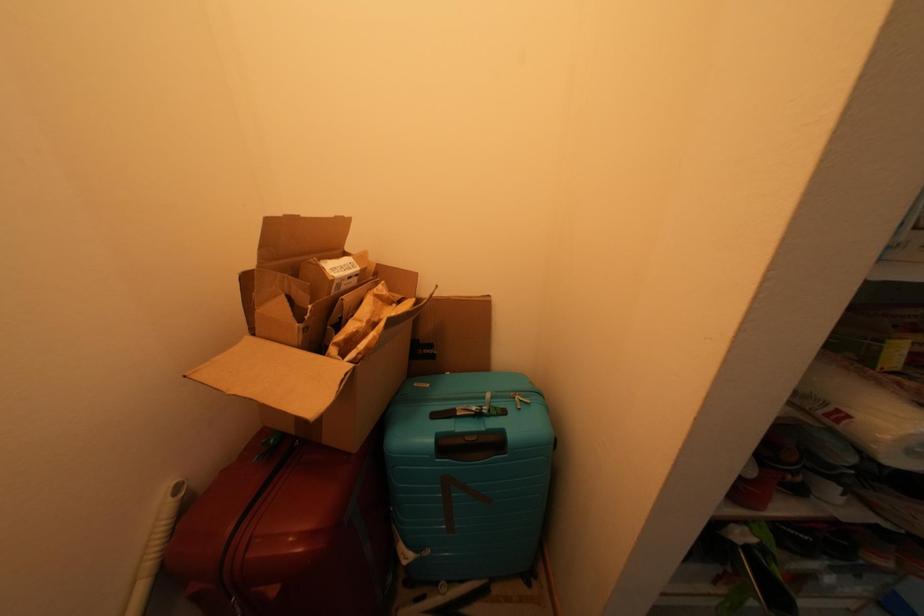
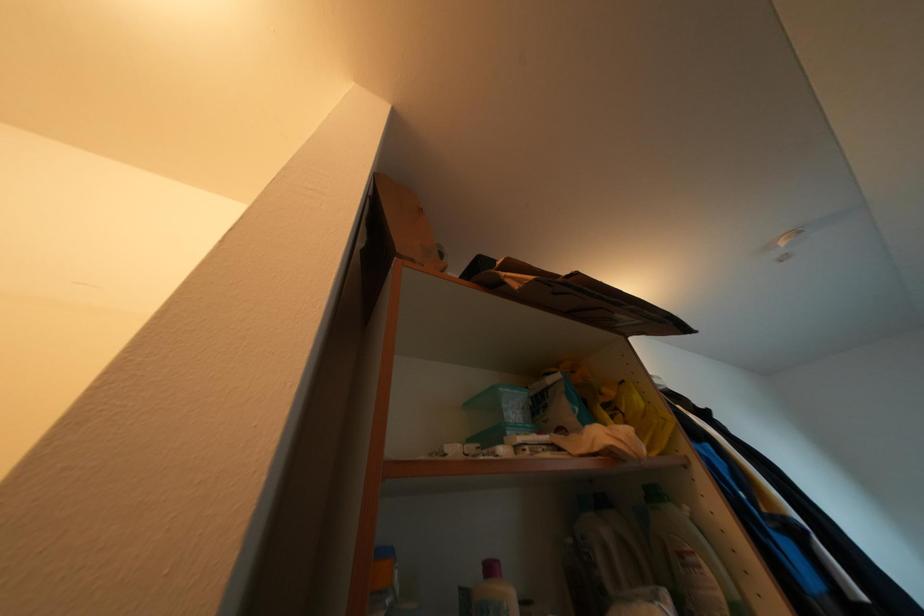
From the picture: The images are taken continuously from a first-person perspective. In which direction is your viewpoint rotating?

The camera rotated toward right-up.